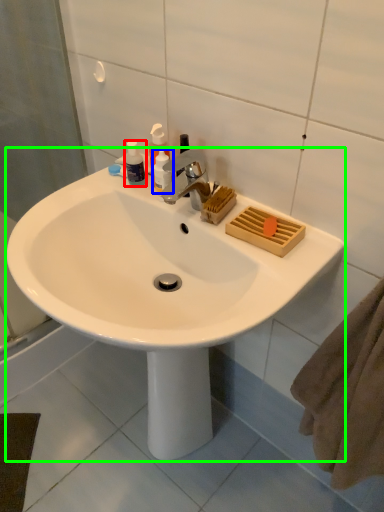
Question: Based on their relative distances, which object is farther from toiletry (highlighted by a red box)? Choose from toiletry (highlighted by a blue box) and sink (highlighted by a green box).

Choices:
 (A) toiletry
 (B) sink

Answer: (B)